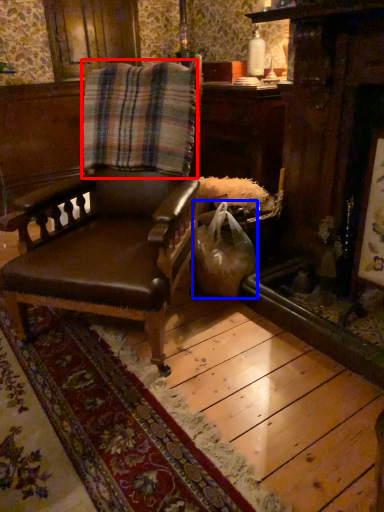
Question: Which point is closer to the camera, blanket (highlighted by a red box) or shopping bag (highlighted by a blue box)?

Choices:
 (A) blanket
 (B) shopping bag

Answer: (A)